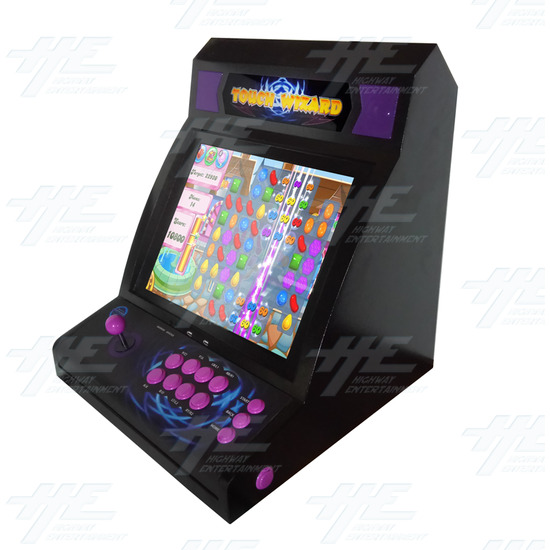
Locate an element on the screen. Image resolution: width=550 pixels, height=550 pixels. purple knob is located at coordinates (115, 324).